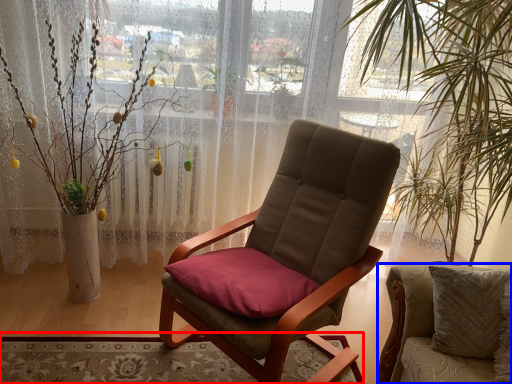
Question: Which point is closer to the camera, mat (highlighted by a red box) or chair (highlighted by a blue box)?

Choices:
 (A) mat
 (B) chair

Answer: (B)